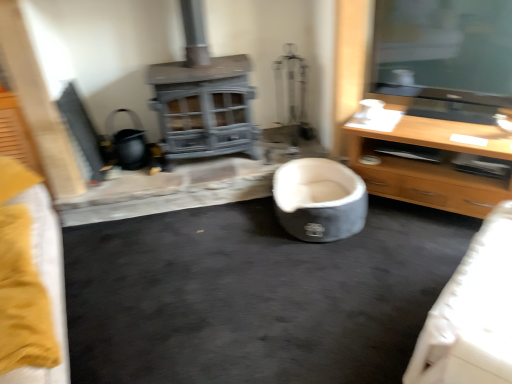
Identify the location of vacant area that is situated to the right of soft gray fabric bean bag at center. The width and height of the screenshot is (512, 384). (403, 233).